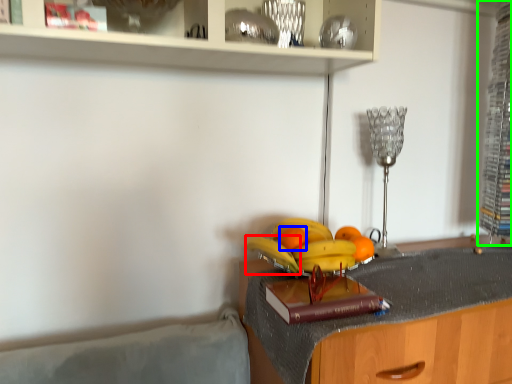
Question: Which object is the farthest from banana (highlighted by a red box)? Choose among these: orange (highlighted by a blue box) or cabinet (highlighted by a green box).

Choices:
 (A) orange
 (B) cabinet

Answer: (B)